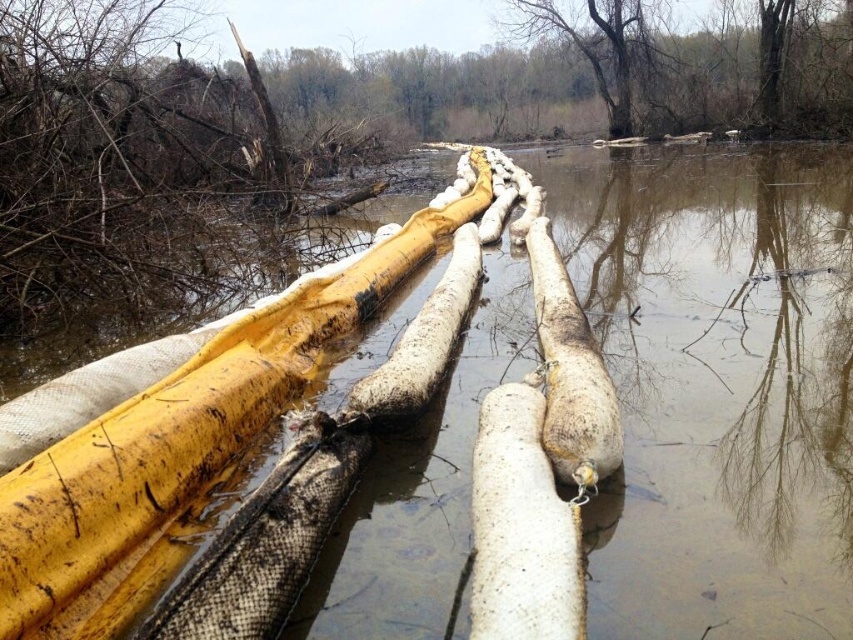
Looking at this image, who is more distant from viewer, [509,413] or [590,56]?

The point [590,56] is more distant.

Between white rough log at center and brown bark tree at upper center, which one is positioned higher?

brown bark tree at upper center is higher up.

The width and height of the screenshot is (853, 640). Find the location of `white rough log at center`. white rough log at center is located at coordinates (521, 528).